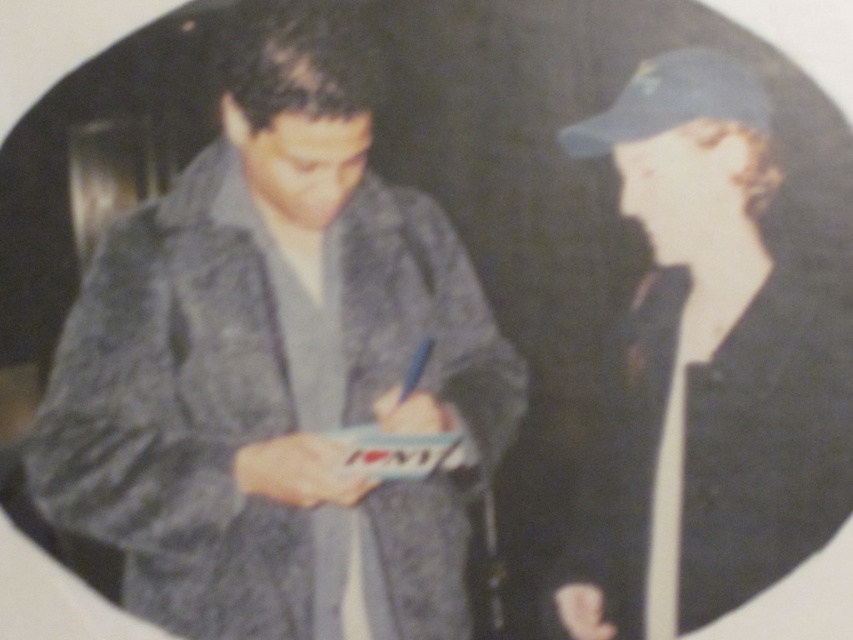
You are a photographer standing in the scene and want to place a matte blue cap at upper right on a shelf that is 1.5 meters away from you. Can the cap be placed on the shelf?

The matte blue cap at upper right is 1.35 meters from the viewer, so it is closer than the shelf which is 1.5 meters away. Therefore, the cap cannot be placed on the shelf as it is already positioned closer to you than the shelf.

You are a photographer trying to frame a new shot that matches the original photo. You need to place two objects, the matte blue cap at upper right and the dark blue felt baseball hat at upper right, exactly where they were in the original image. Given that the distance between them in the original was 20.21 centimeters, how far apart should you place them in your new setup?

You should place the matte blue cap at upper right and the dark blue felt baseball hat at upper right exactly 20.21 centimeters apart to match the original image.